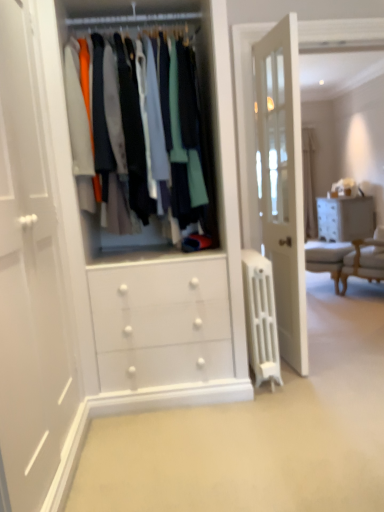
This screenshot has height=512, width=384. Describe the element at coordinates (261, 318) in the screenshot. I see `white painted radiator at center` at that location.

Where is `white textured chest of drawers at right`? The width and height of the screenshot is (384, 512). white textured chest of drawers at right is located at coordinates (345, 218).

What is the approximate width of light beige fabric armchair at right?

light beige fabric armchair at right is 21.00 inches wide.

Locate an element on the screen. This screenshot has width=384, height=512. light beige fabric armchair at right is located at coordinates (365, 259).

Locate an element on the screen. This screenshot has height=512, width=384. matte white clothes at center is located at coordinates (120, 128).

This screenshot has width=384, height=512. In order to click on white painted radiator at center in this screenshot , I will do `click(261, 318)`.

Can you see white painted radiator at center touching white textured chest of drawers at right?

There is a gap between white painted radiator at center and white textured chest of drawers at right.

Between white painted radiator at center and white textured chest of drawers at right, which one is positioned behind?

white textured chest of drawers at right.

Is white painted radiator at center oriented away from white textured chest of drawers at right?

No, white painted radiator at center is not facing away from white textured chest of drawers at right.

From a real-world perspective, is light beige fabric armchair at right located beneath white painted radiator at center?

Actually, light beige fabric armchair at right is physically above white painted radiator at center in the real world.

Is light beige fabric armchair at right inside or outside of white painted radiator at center?

light beige fabric armchair at right is located beyond the bounds of white painted radiator at center.

Could you tell me if light beige fabric armchair at right is facing white painted radiator at center?

No, light beige fabric armchair at right does not turn towards white painted radiator at center.

Considering the sizes of light beige fabric armchair at right and white painted radiator at center in the image, is light beige fabric armchair at right taller or shorter than white painted radiator at center?

In the image, light beige fabric armchair at right appears to be taller than white painted radiator at center.

From the picture: Which is further, (104, 193) or (369, 247)?

The point (369, 247) is farther.

From the image's perspective, is matte white clothes at center positioned above or below light beige fabric armchair at right?

matte white clothes at center is situated higher than light beige fabric armchair at right in the image.

Which is in front, matte white clothes at center or light beige fabric armchair at right?

matte white clothes at center is closer to the camera.

Is there a large distance between matte white clothes at center and light beige fabric armchair at right?

Indeed, matte white clothes at center is not near light beige fabric armchair at right.

Does point (135, 111) lie in front of point (317, 215)?

Yes, it is in front of point (317, 215).

From a real-world perspective, which is physically above, matte white clothes at center or white textured chest of drawers at right?

matte white clothes at center, from a real-world perspective.

Is matte white clothes at center aimed at white textured chest of drawers at right?

No, matte white clothes at center is not facing towards white textured chest of drawers at right.

Does light beige fabric armchair at right have a lesser width compared to matte white clothes at center?

Yes.

From the image's perspective, which one is positioned lower, light beige fabric armchair at right or matte white clothes at center?

light beige fabric armchair at right is shown below in the image.

Considering the relative sizes of light beige fabric armchair at right and matte white clothes at center in the image provided, is light beige fabric armchair at right taller than matte white clothes at center?

Incorrect, the height of light beige fabric armchair at right is not larger of that of matte white clothes at center.

Is light beige fabric armchair at right positioned far away from matte white clothes at center?

Absolutely, light beige fabric armchair at right is distant from matte white clothes at center.

Consider the image. What's the angular difference between matte white clothes at center and white painted radiator at center's facing directions?

The angular difference between matte white clothes at center and white painted radiator at center is 1.62 degrees.

From the image's perspective, is matte white clothes at center below white painted radiator at center?

No, from the image's perspective, matte white clothes at center is not beneath white painted radiator at center.

Considering the sizes of objects matte white clothes at center and white painted radiator at center in the image provided, who is taller, matte white clothes at center or white painted radiator at center?

Standing taller between the two is matte white clothes at center.

How distant is matte white clothes at center from white painted radiator at center?

They are 27.42 inches apart.

Is white textured chest of drawers at right with white painted radiator at center?

No, white textured chest of drawers at right is not beside white painted radiator at center.

Is white textured chest of drawers at right inside the boundaries of white painted radiator at center, or outside?

white textured chest of drawers at right is located beyond the bounds of white painted radiator at center.

Does point (329, 231) come in front of point (269, 317)?

No.

Considering the relative sizes of white textured chest of drawers at right and white painted radiator at center in the image provided, is white textured chest of drawers at right taller than white painted radiator at center?

Yes, white textured chest of drawers at right is taller than white painted radiator at center.

You are a GUI agent. You are given a task and a screenshot of the screen. Output one action in this format:
    pyautogui.click(x=<x>, y=<y>)
    Task: Click on the wide below the white textured chest of drawers at right (from a real-world perspective)
    
    Given the screenshot: What is the action you would take?
    [261, 318]

This screenshot has height=512, width=384. I want to click on furniture above the white painted radiator at center (from the image's perspective), so click(x=365, y=259).

Based on their spatial positions, is matte white clothes at center or white painted radiator at center further from white textured chest of drawers at right?

matte white clothes at center is further to white textured chest of drawers at right.

Considering their positions, is light beige fabric armchair at right positioned closer to white painted radiator at center than matte white clothes at center?

matte white clothes at center is positioned closer to the anchor white painted radiator at center.

From the picture: When comparing their distances from matte white clothes at center, does light beige fabric armchair at right or white textured chest of drawers at right seem further?

white textured chest of drawers at right is positioned further to the anchor matte white clothes at center.

Considering their positions, is matte white clothes at center positioned further to white textured chest of drawers at right than light beige fabric armchair at right?

Based on the image, matte white clothes at center appears to be further to white textured chest of drawers at right.

Estimate the real-world distances between objects in this image. Which object is closer to white textured chest of drawers at right, white painted radiator at center or light beige fabric armchair at right?

light beige fabric armchair at right lies closer to white textured chest of drawers at right than the other object.

Considering their positions, is light beige fabric armchair at right positioned further to white textured chest of drawers at right than white painted radiator at center?

The object further to white textured chest of drawers at right is white painted radiator at center.

Which object lies nearer to the anchor point matte white clothes at center, white textured chest of drawers at right or light beige fabric armchair at right?

Among the two, light beige fabric armchair at right is located nearer to matte white clothes at center.

Considering their positions, is white textured chest of drawers at right positioned closer to white painted radiator at center than light beige fabric armchair at right?

The object closer to white painted radiator at center is light beige fabric armchair at right.

You are a GUI agent. You are given a task and a screenshot of the screen. Output one action in this format:
    pyautogui.click(x=<x>, y=<y>)
    Task: Click on the wide located between matte white clothes at center and light beige fabric armchair at right in the left-right direction
    The image size is (384, 512).
    Given the screenshot: What is the action you would take?
    pyautogui.click(x=261, y=318)

Locate an element on the screen. furniture located between white painted radiator at center and white textured chest of drawers at right in the depth direction is located at coordinates (365, 259).

Where is `furniture positioned between matte white clothes at center and white textured chest of drawers at right from near to far`? furniture positioned between matte white clothes at center and white textured chest of drawers at right from near to far is located at coordinates (365, 259).

You are a GUI agent. You are given a task and a screenshot of the screen. Output one action in this format:
    pyautogui.click(x=<x>, y=<y>)
    Task: Click on the wide between matte white clothes at center and white textured chest of drawers at right along the z-axis
    This screenshot has height=512, width=384.
    Given the screenshot: What is the action you would take?
    pyautogui.click(x=261, y=318)